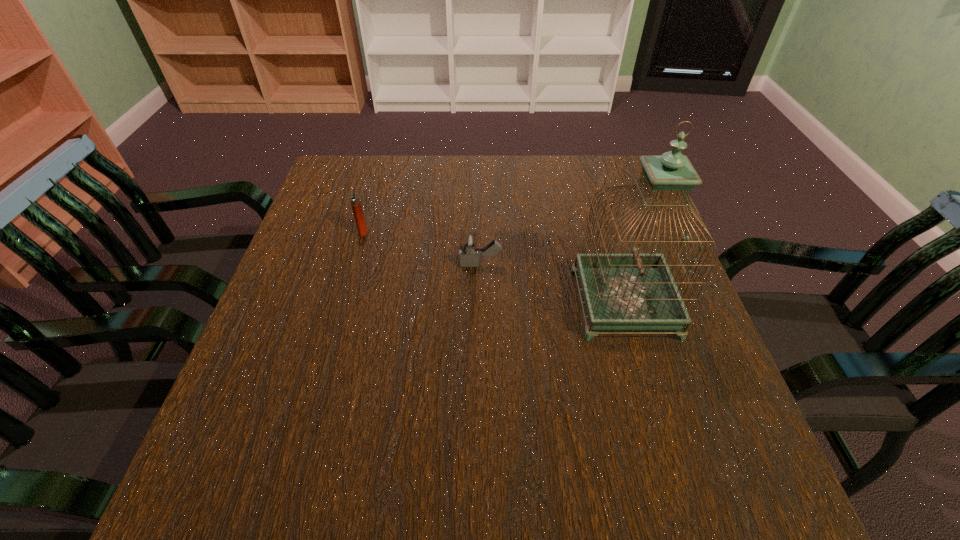
Where is `blank space located 0.060m on the front of the right igniter`? This screenshot has width=960, height=540. blank space located 0.060m on the front of the right igniter is located at coordinates click(480, 292).

At what (x,y) coordinates should I click in order to perform the action: click on object positioned at the left edge. Please return your answer as a coordinate pair (x, y). Looking at the image, I should click on 355,200.

You are a GUI agent. You are given a task and a screenshot of the screen. Output one action in this format:
    pyautogui.click(x=<x>, y=<y>)
    Task: Click on the object that is positioned at the right edge
    The image size is (960, 540).
    Given the screenshot: What is the action you would take?
    pyautogui.click(x=635, y=291)

Find the location of a particular element. The width and height of the screenshot is (960, 540). vacant space at the far edge of the desktop is located at coordinates (468, 163).

Identify the location of free region at the near edge. (533, 500).

The width and height of the screenshot is (960, 540). Identify the location of free space at the left edge. (349, 286).

Identify the location of vacant space at the near left corner. Image resolution: width=960 pixels, height=540 pixels. (270, 514).

The height and width of the screenshot is (540, 960). What are the coordinates of `vacant region between the right igniter and the leftmost object` in the screenshot? It's located at (421, 248).

Find the location of a particular element. free space between the birdcage and the right igniter is located at coordinates (552, 284).

Where is `vacant space that's between the nearer igniter and the birdcage`? This screenshot has width=960, height=540. vacant space that's between the nearer igniter and the birdcage is located at coordinates (552, 284).